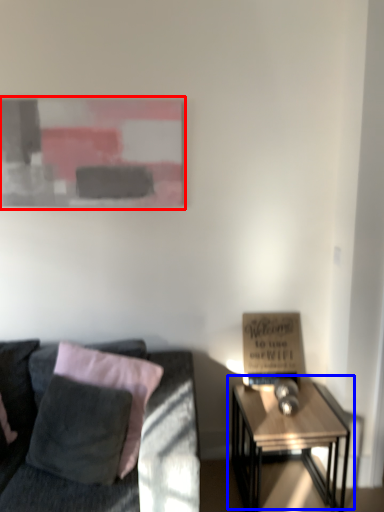
Question: Which object appears closest to the camera in this image, picture frame (highlighted by a red box) or table (highlighted by a blue box)?

Choices:
 (A) picture frame
 (B) table

Answer: (B)